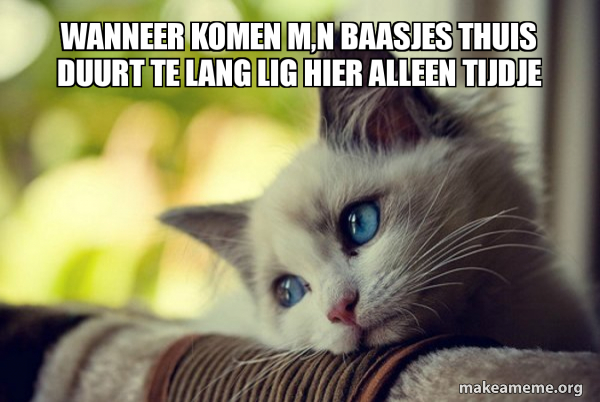
Locate an element on the screen. The image size is (600, 402). couch is located at coordinates (103, 357).